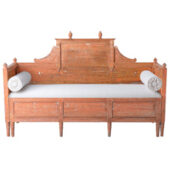
Find the location of a particular element. bench leg 4 is located at coordinates (109, 128).